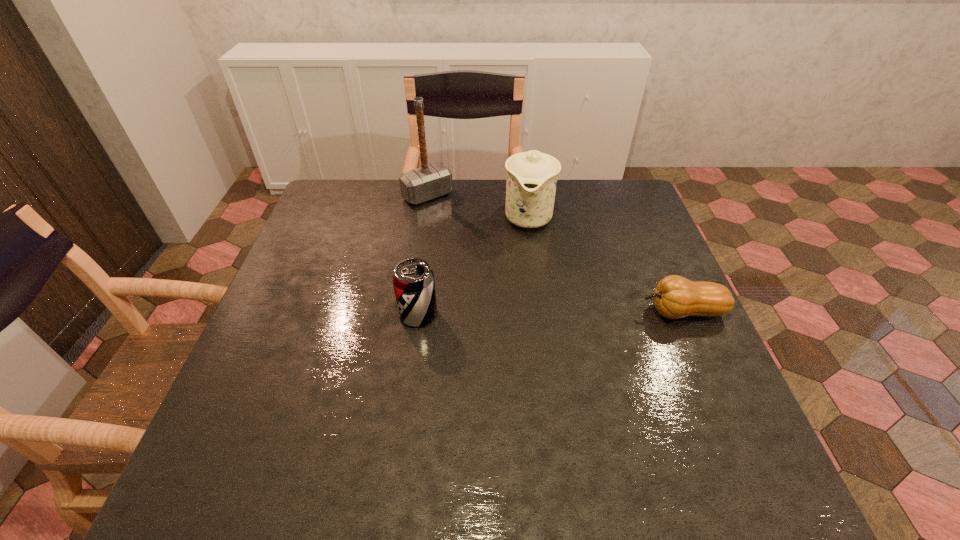
This screenshot has width=960, height=540. Find the location of `soda can`. soda can is located at coordinates (413, 280).

You are a GUI agent. You are given a task and a screenshot of the screen. Output one action in this format:
    pyautogui.click(x=<x>, y=<y>)
    Task: Click on the shortest object
    The image size is (960, 540).
    Given the screenshot: What is the action you would take?
    pyautogui.click(x=675, y=297)

Locate an element on the screen. gourd is located at coordinates (675, 297).

What are the coordinates of `the third object from left to right` in the screenshot? It's located at (532, 176).

This screenshot has width=960, height=540. Identify the location of the third shortest object. (532, 176).

Where is `hammer`? hammer is located at coordinates (428, 182).

You are a GUI agent. You are given a task and a screenshot of the screen. Output one action in this format:
    pyautogui.click(x=<x>, y=<y>)
    Task: Click on the free spot located 0.090m on the left of the soda can
    This screenshot has width=960, height=540.
    Given the screenshot: What is the action you would take?
    pyautogui.click(x=362, y=314)

This screenshot has height=540, width=960. I want to click on free space located 0.210m on the stem side of the rightmost object, so click(x=554, y=312).

Identify the location of vacant space located on the stem side of the rightmost object. Image resolution: width=960 pixels, height=540 pixels. (590, 312).

Identify the location of free space located on the stem side of the rightmost object. (524, 312).